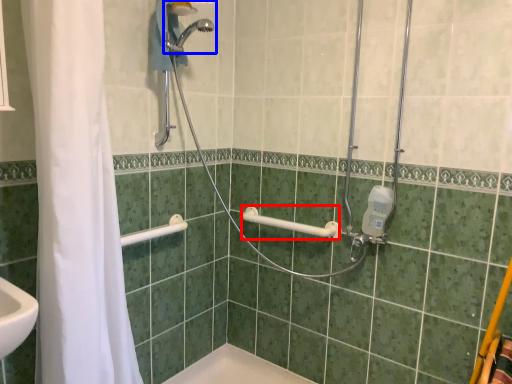
Question: Which object is closer to the camera taking this photo, towel bar (highlighted by a red box) or shower (highlighted by a blue box)?

Choices:
 (A) towel bar
 (B) shower

Answer: (B)